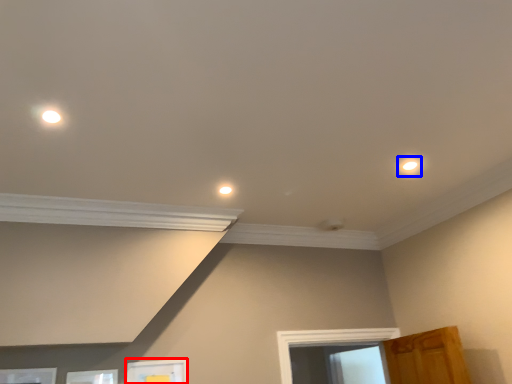
Question: Which object appears farthest to the camera in this image, picture frame (highlighted by a red box) or dot (highlighted by a blue box)?

Choices:
 (A) picture frame
 (B) dot

Answer: (A)